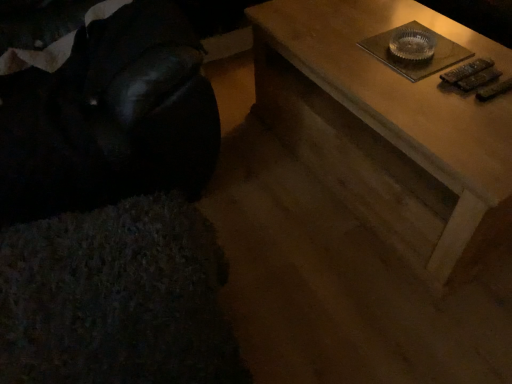
In order to click on velvet black bean bag chair at left in this screenshot , I will do `click(106, 115)`.

Measure the distance between velvet black bean bag chair at left and camera.

4.06 feet.

Describe the element at coordinates (106, 115) in the screenshot. This screenshot has width=512, height=384. I see `velvet black bean bag chair at left` at that location.

The height and width of the screenshot is (384, 512). In order to click on wooden table at upper right in this screenshot , I will do `click(393, 130)`.

What do you see at coordinates (393, 130) in the screenshot? Image resolution: width=512 pixels, height=384 pixels. I see `wooden table at upper right` at bounding box center [393, 130].

The height and width of the screenshot is (384, 512). What are the coordinates of `velvet black bean bag chair at left` in the screenshot? It's located at (106, 115).

Considering the relative positions of wooden table at upper right and velvet black bean bag chair at left in the image provided, is wooden table at upper right to the right of velvet black bean bag chair at left from the viewer's perspective?

Yes, wooden table at upper right is to the right of velvet black bean bag chair at left.

In the image, is wooden table at upper right positioned in front of or behind velvet black bean bag chair at left?

Visually, wooden table at upper right is located behind velvet black bean bag chair at left.

Is point (319, 97) in front of point (132, 109)?

No, (319, 97) is further to viewer.

From the image's perspective, between wooden table at upper right and velvet black bean bag chair at left, which one is located above?

velvet black bean bag chair at left, from the image's perspective.

From a real-world perspective, is wooden table at upper right located beneath velvet black bean bag chair at left?

Correct, in the physical world, wooden table at upper right is lower than velvet black bean bag chair at left.

Can you confirm if wooden table at upper right is thinner than velvet black bean bag chair at left?

No, wooden table at upper right is not thinner than velvet black bean bag chair at left.

Does wooden table at upper right have a lesser height compared to velvet black bean bag chair at left?

Indeed, wooden table at upper right has a lesser height compared to velvet black bean bag chair at left.

Considering the relative sizes of wooden table at upper right and velvet black bean bag chair at left in the image provided, is wooden table at upper right bigger than velvet black bean bag chair at left?

No, wooden table at upper right is not bigger than velvet black bean bag chair at left.

Is wooden table at upper right spatially inside velvet black bean bag chair at left, or outside of it?

The correct answer is: outside.

Is there a large distance between wooden table at upper right and velvet black bean bag chair at left?

wooden table at upper right is near velvet black bean bag chair at left, not far away.

Is wooden table at upper right facing towards velvet black bean bag chair at left?

No, wooden table at upper right is not aimed at velvet black bean bag chair at left.

This screenshot has height=384, width=512. I want to click on table behind the velvet black bean bag chair at left, so click(393, 130).

Is velvet black bean bag chair at left to the right of wooden table at upper right from the viewer's perspective?

Result: No.

Which object is further away from the camera, velvet black bean bag chair at left or wooden table at upper right?

wooden table at upper right is further away from the camera.

Which point is more forward, (2, 177) or (494, 170)?

The point (494, 170) is closer to the camera.

From the picture: From the image's perspective, is velvet black bean bag chair at left beneath wooden table at upper right?

No.

From a real-world perspective, is velvet black bean bag chair at left physically above wooden table at upper right?

Yes.

Does velvet black bean bag chair at left have a greater width compared to wooden table at upper right?

In fact, velvet black bean bag chair at left might be narrower than wooden table at upper right.

Considering the sizes of objects velvet black bean bag chair at left and wooden table at upper right in the image provided, who is taller, velvet black bean bag chair at left or wooden table at upper right?

velvet black bean bag chair at left is taller.

Which of these two, velvet black bean bag chair at left or wooden table at upper right, is bigger?

velvet black bean bag chair at left is bigger.

Is wooden table at upper right inside velvet black bean bag chair at left?

A: No, wooden table at upper right is not surrounded by velvet black bean bag chair at left.

Is velvet black bean bag chair at left next to wooden table at upper right and touching it?

There is a gap between velvet black bean bag chair at left and wooden table at upper right.

Is velvet black bean bag chair at left looking in the opposite direction of wooden table at upper right?

No, velvet black bean bag chair at left is not facing the opposite direction of wooden table at upper right.

How different are the orientations of velvet black bean bag chair at left and wooden table at upper right in degrees?

12.9 degrees separate the facing orientations of velvet black bean bag chair at left and wooden table at upper right.

How far apart are velvet black bean bag chair at left and wooden table at upper right?

velvet black bean bag chair at left is 25.81 inches from wooden table at upper right.

You are a GUI agent. You are given a task and a screenshot of the screen. Output one action in this format:
    pyautogui.click(x=<x>, y=<y>)
    Task: Click on the bean bag chair on the left of wooden table at upper right
    
    Given the screenshot: What is the action you would take?
    pyautogui.click(x=106, y=115)

Locate an element on the screen. Image resolution: width=512 pixels, height=384 pixels. table on the right side of velvet black bean bag chair at left is located at coordinates (393, 130).

This screenshot has width=512, height=384. In order to click on bean bag chair that appears in front of the wooden table at upper right in this screenshot , I will do `click(106, 115)`.